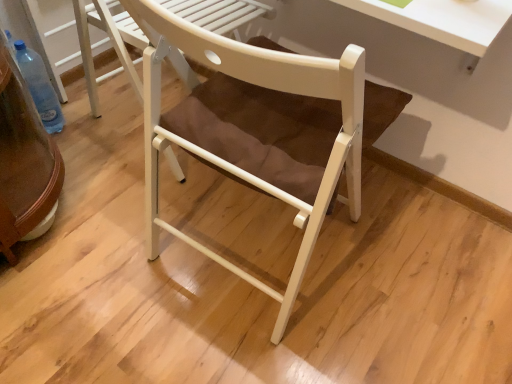
In order to click on empty space that is to the right of transparent plastic bottle at lower left in this screenshot , I will do `click(101, 134)`.